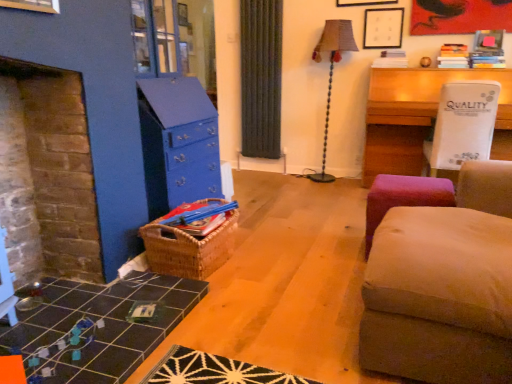
Question: Is point (225, 248) positioned closer to the camera than point (432, 72)?

Choices:
 (A) farther
 (B) closer

Answer: (B)

Question: From the image's perspective, is woven brown basket at center positioned above or below white plastic table at upper right, which appears as the first table when viewed from the top?

Choices:
 (A) below
 (B) above

Answer: (A)

Question: Which is nearer to the matte black picture frame at upper center?

Choices:
 (A) velvet beige ottoman at right
 (B) white plastic table at upper right, marked as the second table in a bottom-to-top arrangement
 (C) woven brown basket at center
 (D) pink fabric stool at lower right
 (E) black tile table at lower left, positioned as the 1th table in bottom-to-top order

Answer: (B)

Question: Estimate the real-world distances between objects in this image. Which object is closer to the woven brown basket at center?

Choices:
 (A) black tile table at lower left, acting as the 2th table starting from the right
 (B) white plastic table at upper right, which ranks as the 2th table in left-to-right order
 (C) matte black picture frame at upper center
 (D) velvet beige ottoman at right
 (E) textured beige lampshade at center-right

Answer: (A)